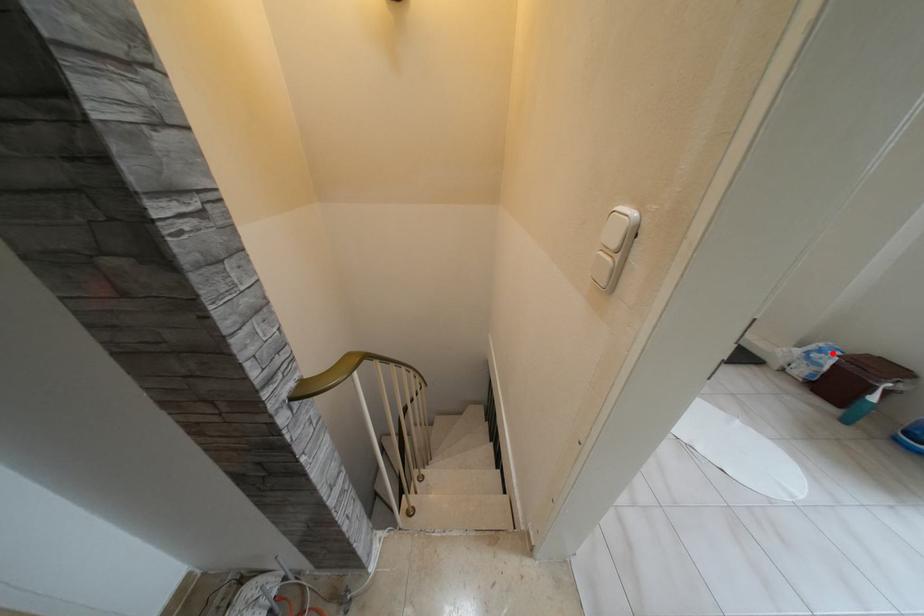
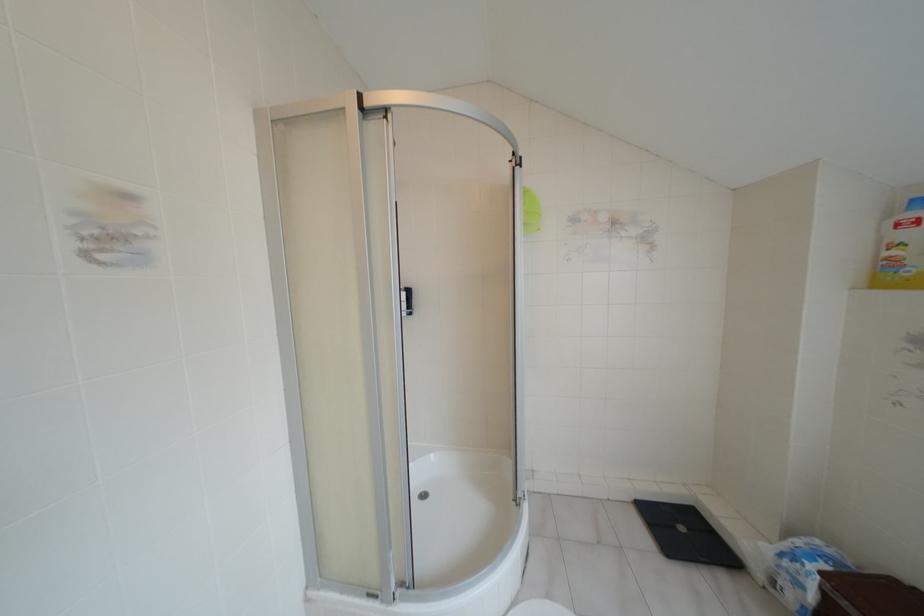
The point at the highlighted location is marked in the first image. Where is the corresponding point in the second image?

(809, 565)